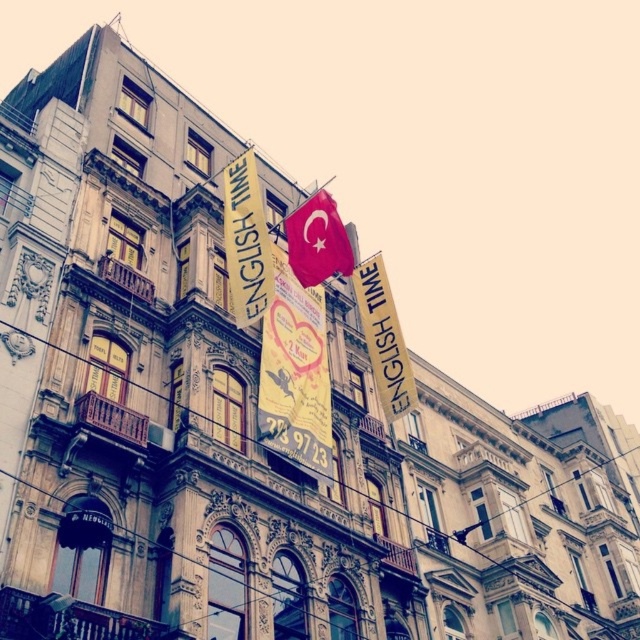
You are a window cleaner standing on a platform that can only move horizontally. You need to clean both the yellow fabric sign at upper center and the yellow paper banner at upper center. Which one should you clean first based on their positions?

You should clean the yellow fabric sign at upper center first because it is in front of the yellow paper banner at upper center. Once the fabric sign is cleaned, you can then access the paper banner behind it without obstruction.

Based on the photo, you are a window cleaner standing on a platform that can reach up to 20 feet. You need to clean both the yellow paper banner at upper center and the red fabric flag at center. Can you clean both without moving the platform?

The distance between the yellow paper banner at upper center and the red fabric flag at center is 20.22 feet, which exceeds the platform height of 20 feet. Therefore, you cannot clean both without moving the platform.